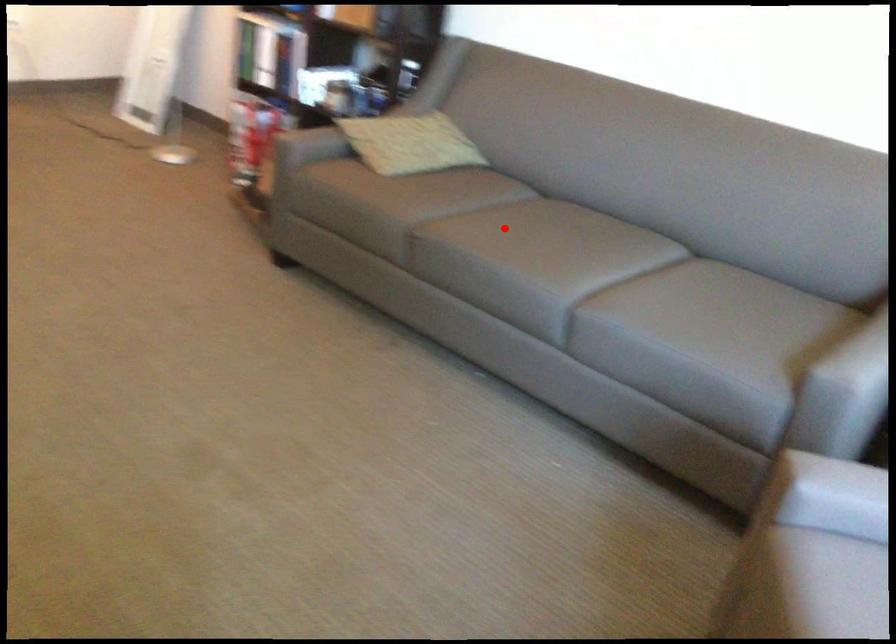
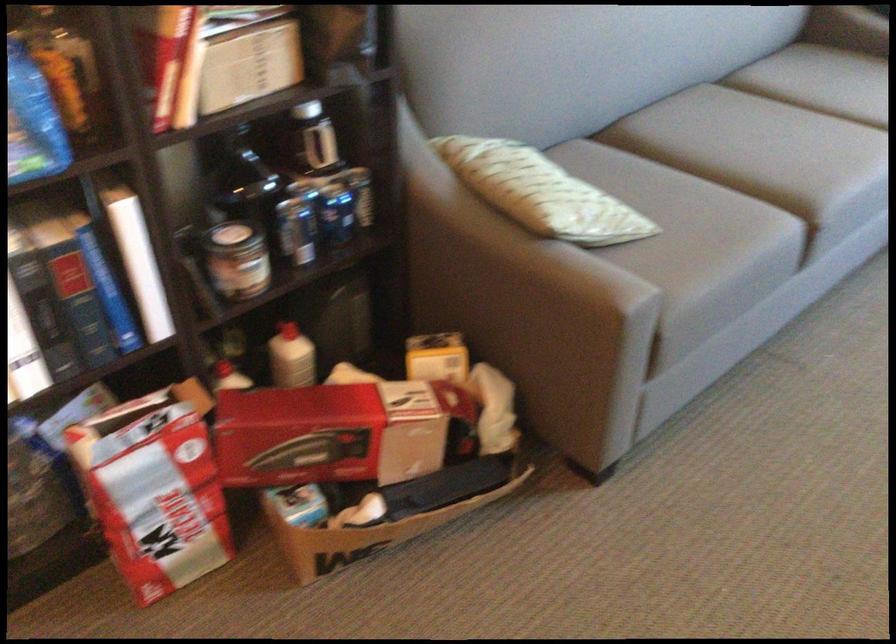
Find the pixel in the second image that matches the highlighted location in the first image.

(760, 147)